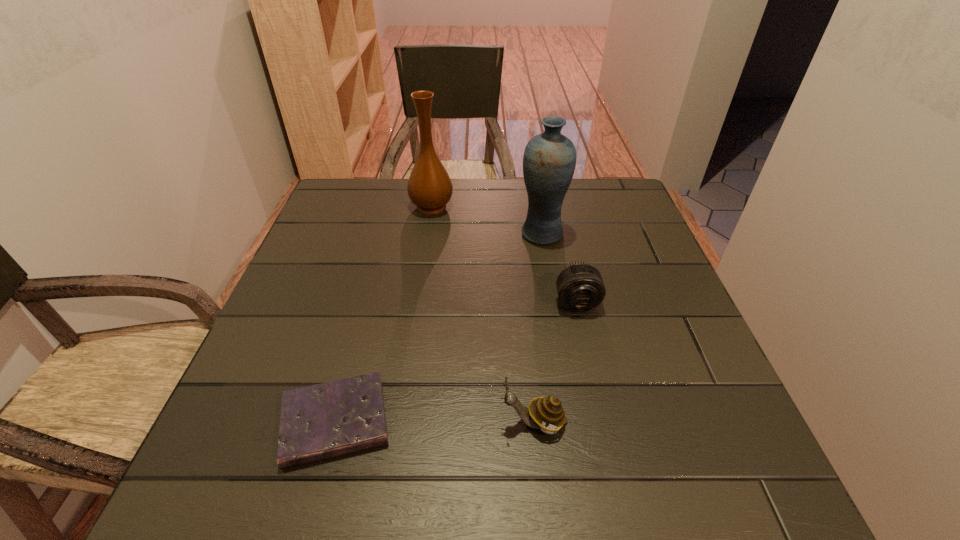
Where is `free space located on the face of the snail`? free space located on the face of the snail is located at coordinates (276, 423).

Locate an element on the screen. The width and height of the screenshot is (960, 540). vacant area located on the face of the snail is located at coordinates (460, 423).

Locate an element on the screen. The image size is (960, 540). free region located 0.060m on the face of the snail is located at coordinates (466, 423).

Locate an element on the screen. This screenshot has height=540, width=960. vacant space located on the front-facing side of the third nearest object is located at coordinates (600, 405).

Image resolution: width=960 pixels, height=540 pixels. What are the coordinates of `free region located on the right of the shortest object` in the screenshot? It's located at (433, 422).

The width and height of the screenshot is (960, 540). What are the coordinates of `object that is at the near edge` in the screenshot? It's located at (321, 421).

Locate an element on the screen. Image resolution: width=960 pixels, height=540 pixels. object present at the left edge is located at coordinates (321, 421).

Image resolution: width=960 pixels, height=540 pixels. What are the coordinates of `object that is at the near left corner` in the screenshot? It's located at (321, 421).

Image resolution: width=960 pixels, height=540 pixels. In the image, there is a desktop. Identify the location of vacant space at the far edge. (575, 194).

Find the location of `free space at the near edge of the desktop`. free space at the near edge of the desktop is located at coordinates (454, 465).